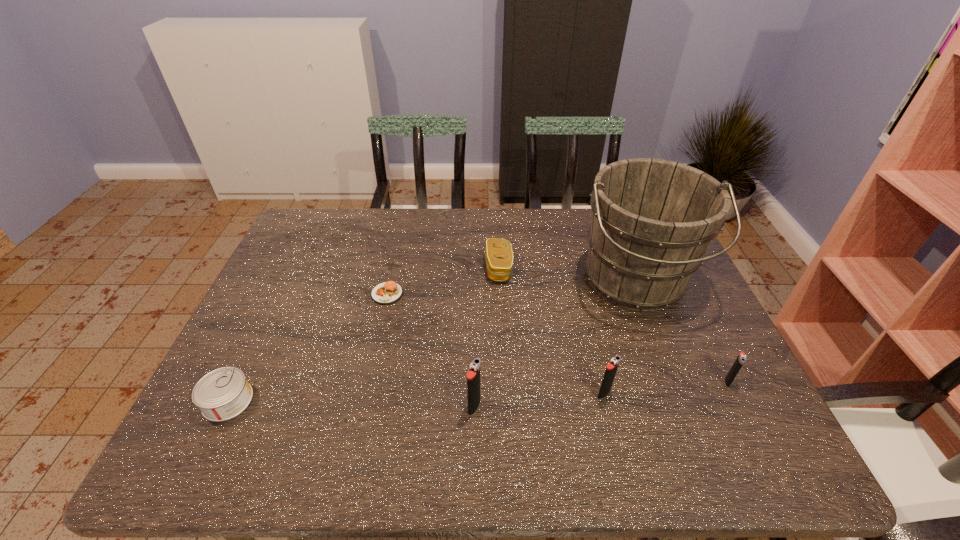
The width and height of the screenshot is (960, 540). In order to click on the fifth object from right to left in this screenshot , I will do `click(473, 376)`.

Where is `the leftmost igniter`? the leftmost igniter is located at coordinates (473, 376).

Locate an element on the screen. This screenshot has width=960, height=540. the fifth shortest object is located at coordinates (611, 369).

This screenshot has width=960, height=540. Find the location of `the second igniter from right to left`. the second igniter from right to left is located at coordinates (611, 369).

This screenshot has width=960, height=540. In order to click on the fourth tallest object in this screenshot , I will do tap(741, 358).

This screenshot has width=960, height=540. I want to click on the shortest igniter, so click(741, 358).

This screenshot has height=540, width=960. I want to click on the fourth object from right to left, so click(x=498, y=253).

The width and height of the screenshot is (960, 540). What are the coordinates of `the third shortest object` in the screenshot? It's located at (498, 253).

The width and height of the screenshot is (960, 540). Find the location of `patty`. patty is located at coordinates (389, 292).

The width and height of the screenshot is (960, 540). I want to click on the sixth object from right to left, so click(x=389, y=292).